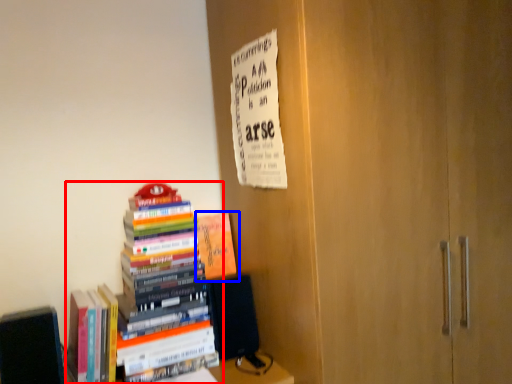
Question: Which point is closer to the camera, book (highlighted by a red box) or book (highlighted by a blue box)?

Choices:
 (A) book
 (B) book

Answer: (A)